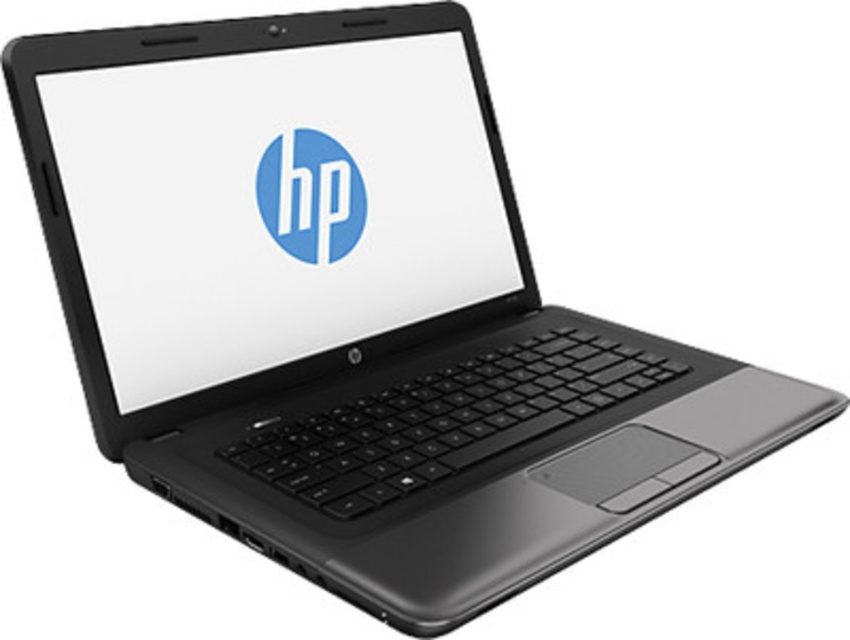
Question: Which point is closer to the camera?

Choices:
 (A) blue glossy logo at center
 (B) matte black screen at center

Answer: (B)

Question: Which point is closer to the camera taking this photo?

Choices:
 (A) (341, 244)
 (B) (312, 164)

Answer: (B)

Question: Can you confirm if matte black screen at center is positioned above blue glossy logo at center?

Choices:
 (A) yes
 (B) no

Answer: (A)

Question: Is matte black screen at center below blue glossy logo at center?

Choices:
 (A) no
 (B) yes

Answer: (A)

Question: Can you confirm if matte black screen at center is smaller than blue glossy logo at center?

Choices:
 (A) no
 (B) yes

Answer: (A)